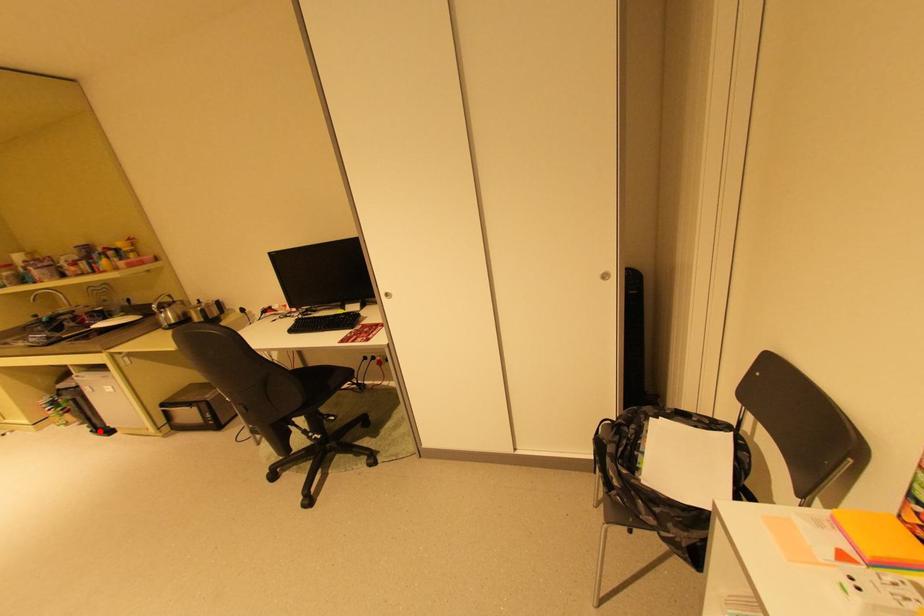
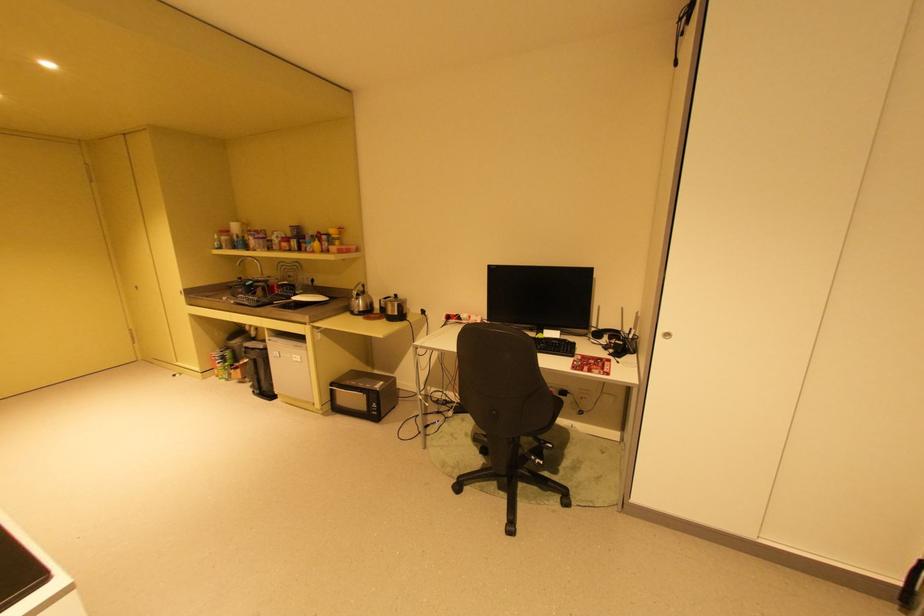
Question: A red point is marked in image1. In image2, is the corresponding 3D point closer to the camera or farther? Reply with the corresponding letter.

Choices:
 (A) The corresponding 3D point is closer.
 (B) The corresponding 3D point is farther.

Answer: (B)